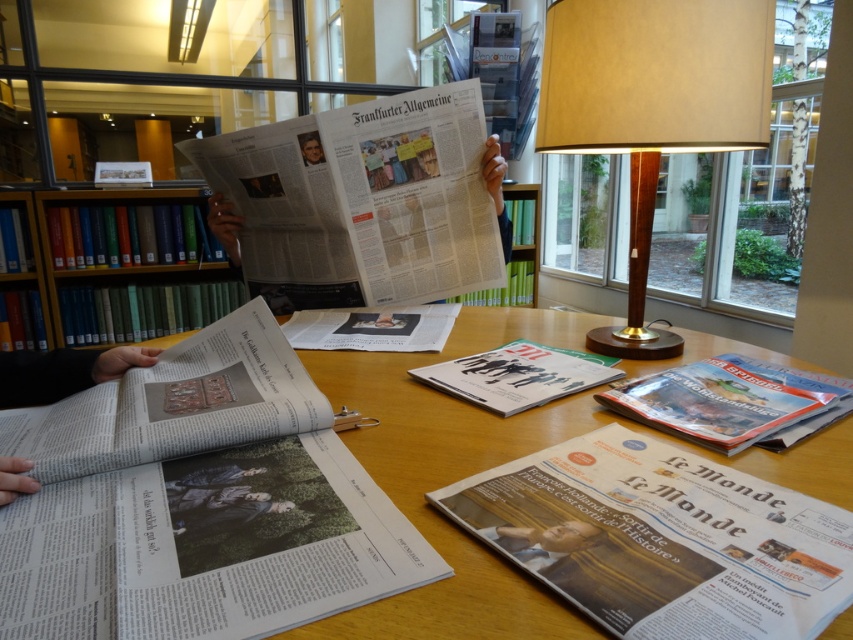
You are a visitor in this library and want to take a photo of both the green matte bookshelf at upper left and the smooth skin face at upper center. Your camera has a maximum focus range of 1.5 meters. Can you capture both in the same frame without moving the camera?

The green matte bookshelf at upper left and smooth skin face at upper center are 1.67 meters apart. Since the distance between them exceeds the camera maximum focus range of 1.5 meters, you cannot capture both in the same frame without moving the camera.